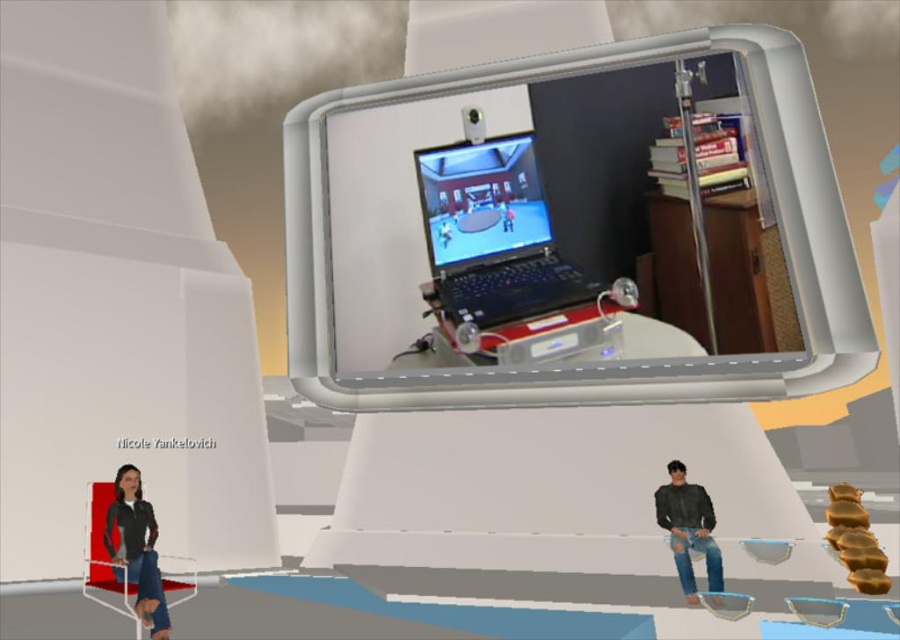
In the scene shown: You are a virtual assistant in a game. You need to determine which piece of clothing is bigger between the dark gray fabric jacket at lower left and the ripped denim jeans at lower right. Which one is larger?

The dark gray fabric jacket at lower left is larger than the ripped denim jeans at lower right.

You are a virtual assistant in a meeting room. You need to place a virtual notepad between the two avatars so that it is equidistant from both. Given that the left avatar is at point [509,246] and the right avatar is at point 0.614, 0.567, where should you place the notepad? Please provide the coordinates.

The notepad should be placed at the midpoint between the two avatars. The midpoint coordinates are calculated by averaging the x and y values of both points. The x coordinate is 0.5, the y coordinate remains 0.567. Therefore, the notepad should be placed at point 0.5, 0.567.

You are a virtual assistant in this environment. You need to place a new object between the black plastic laptop at center and the dark gray fabric jacket at lower left. Which side should you place it closer to so that the new object is closer to the thinner object?

The black plastic laptop at center is thinner than the dark gray fabric jacket at lower left, so you should place the new object closer to the black plastic laptop at center.